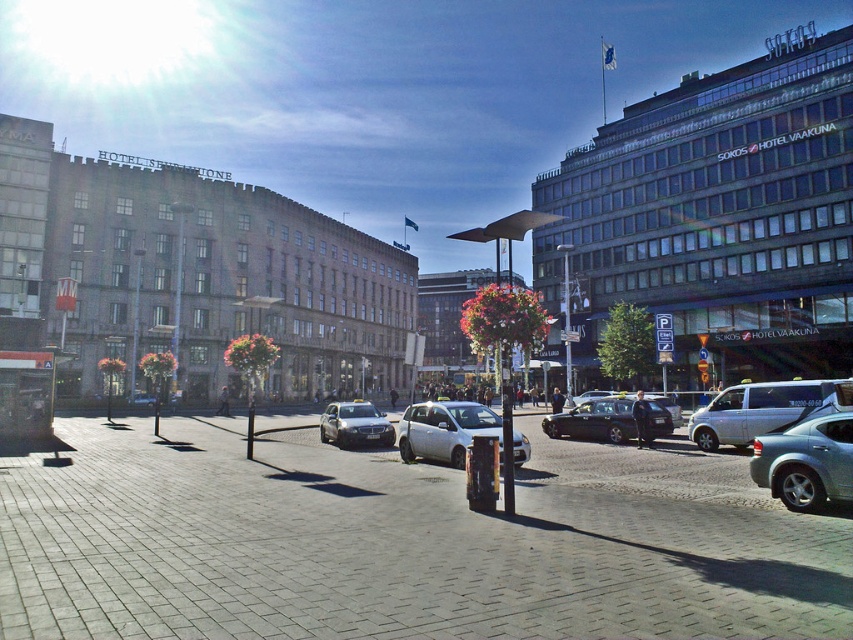
You are a delivery person trying to park your 1.8 meters wide motorcycle in the parking area. You see the white matte car at center and the silver metallic sedan at center. Which vehicle has a narrower width, allowing more space for your motorcycle?

The white matte car at center has a narrower width than the silver metallic sedan at center, so there might be more space available near it for your motorcycle.

You are standing at the pedestrian zone and want to reach a destination located at point (x=592, y=419). There is an obstacle at point (x=757, y=401). Will you need to go around the obstacle to reach your destination?

Point (x=757, y=401) is in front of point (x=592, y=419), so the obstacle at point (x=757, y=401) is blocking the path. You will need to go around the obstacle to reach your destination.